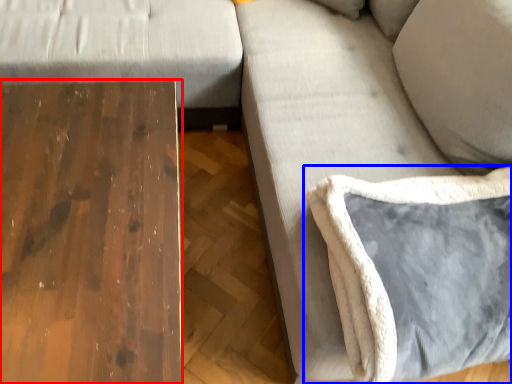
Question: Which point is closer to the camera, table (highlighted by a red box) or pillow (highlighted by a blue box)?

Choices:
 (A) table
 (B) pillow

Answer: (A)